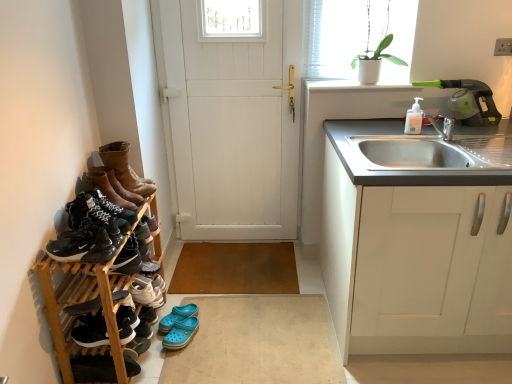
Question: Does black suede shoe at lower left, positioned as the first footwear in bottom-to-top order, have a lesser height compared to leather boots at left, arranged as the 10th footwear when ordered from the bottom?

Choices:
 (A) no
 (B) yes

Answer: (B)

Question: Is black suede shoe at lower left, arranged as the 10th footwear when viewed from the top, facing towards leather boots at left, arranged as the 10th footwear when ordered from the bottom?

Choices:
 (A) no
 (B) yes

Answer: (A)

Question: Is black suede shoe at lower left, positioned as the first footwear in bottom-to-top order, positioned beyond the bounds of leather boots at left, arranged as the 10th footwear when ordered from the bottom?

Choices:
 (A) yes
 (B) no

Answer: (A)

Question: Considering the relative sizes of black suede shoe at lower left, arranged as the 10th footwear when viewed from the top, and leather boots at left, the first footwear positioned from the top, in the image provided, is black suede shoe at lower left, arranged as the 10th footwear when viewed from the top, thinner than leather boots at left, the first footwear positioned from the top,?

Choices:
 (A) yes
 (B) no

Answer: (B)

Question: From a real-world perspective, is black suede shoe at lower left, arranged as the 10th footwear when viewed from the top, below leather boots at left, arranged as the 10th footwear when ordered from the bottom?

Choices:
 (A) no
 (B) yes

Answer: (B)

Question: From the image's perspective, relative to leather boots at left, arranged as the 10th footwear when ordered from the bottom, is white smooth window sill at upper right above or below?

Choices:
 (A) below
 (B) above

Answer: (B)

Question: Relative to leather boots at left, the first footwear positioned from the top, is white smooth window sill at upper right in front or behind?

Choices:
 (A) behind
 (B) front

Answer: (A)

Question: In terms of height, does white smooth window sill at upper right look taller or shorter compared to leather boots at left, the first footwear positioned from the top?

Choices:
 (A) short
 (B) tall

Answer: (A)

Question: In terms of width, does white smooth window sill at upper right look wider or thinner when compared to leather boots at left, arranged as the 10th footwear when ordered from the bottom?

Choices:
 (A) wide
 (B) thin

Answer: (B)

Question: Is black matte sneakers at left, placed as the 1th shoe when sorted from bottom to top, taller or shorter than leather boots at left, the first footwear positioned from the top?

Choices:
 (A) short
 (B) tall

Answer: (A)

Question: Based on their sizes in the image, would you say black matte sneakers at left, placed as the 1th shoe when sorted from bottom to top, is bigger or smaller than leather boots at left, the first footwear positioned from the top?

Choices:
 (A) big
 (B) small

Answer: (B)

Question: Looking at their shapes, would you say black matte sneakers at left, acting as the second shoe starting from the top, is wider or thinner than leather boots at left, arranged as the 10th footwear when ordered from the bottom?

Choices:
 (A) wide
 (B) thin

Answer: (B)

Question: Is black matte sneakers at left, acting as the second shoe starting from the top, inside the boundaries of leather boots at left, arranged as the 10th footwear when ordered from the bottom, or outside?

Choices:
 (A) outside
 (B) inside

Answer: (A)

Question: Which is correct: white smooth window sill at upper right is inside white wooden door at center, or outside of it?

Choices:
 (A) inside
 (B) outside

Answer: (B)

Question: Relative to white wooden door at center, is white smooth window sill at upper right in front or behind?

Choices:
 (A) behind
 (B) front

Answer: (A)